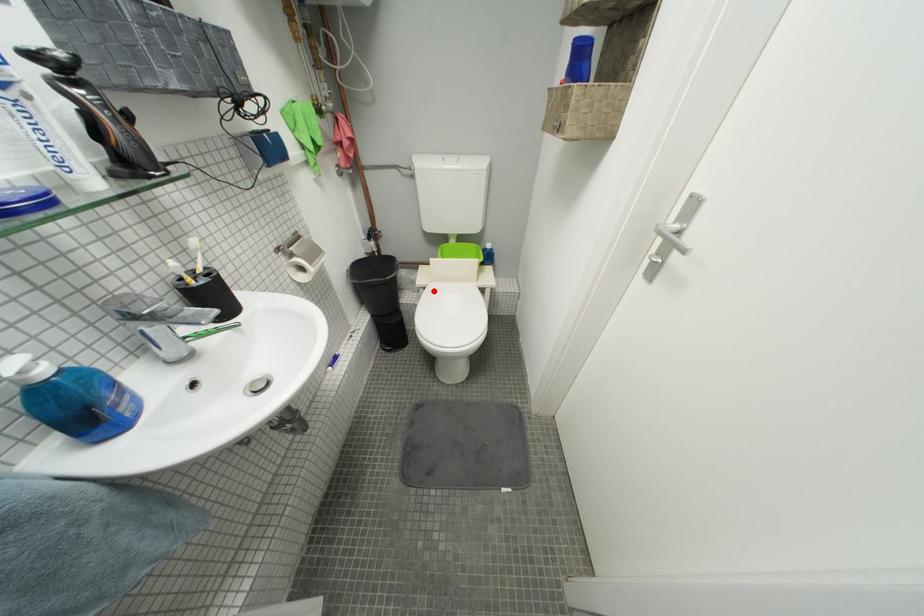
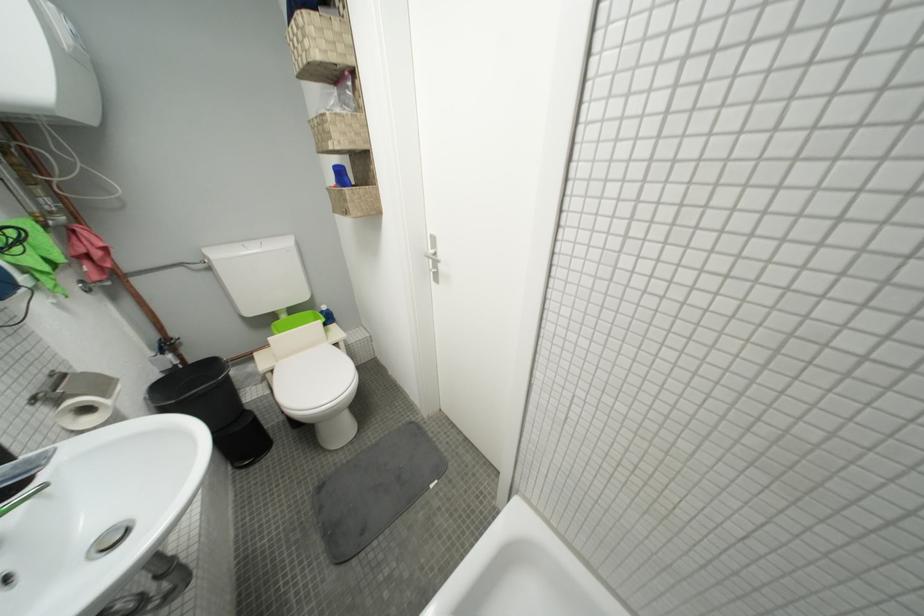
Question: I am providing you with two images of the same scene from different viewpoints. A red point is shown in image1. For the corresponding object point in image2, is it positioned nearer or farther from the camera?

Choices:
 (A) Nearer
 (B) Farther

Answer: (B)